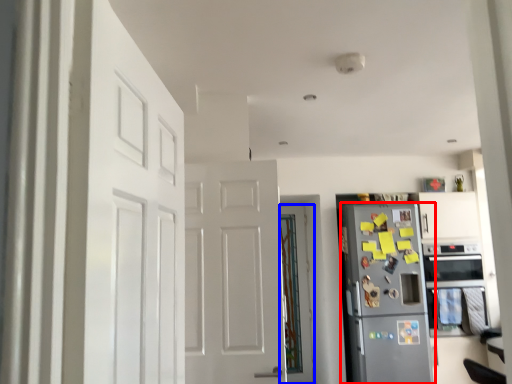
Question: Which object appears closest to the camera in this image, refrigerator (highlighted by a red box) or door (highlighted by a blue box)?

Choices:
 (A) refrigerator
 (B) door

Answer: (A)